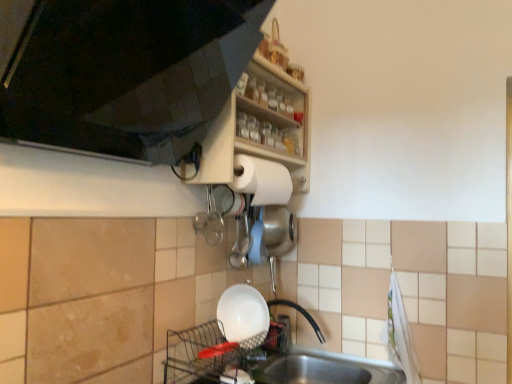
Question: From the image's perspective, is matte wood shelf at upper center positioned above or below white glossy bowl at lower center?

Choices:
 (A) below
 (B) above

Answer: (B)

Question: Is matte wood shelf at upper center inside the boundaries of white glossy bowl at lower center, or outside?

Choices:
 (A) inside
 (B) outside

Answer: (B)

Question: Estimate the real-world distances between objects in this image. Which object is closer to the stainless steel sink at lower center?

Choices:
 (A) wooden shelf at upper center
 (B) matte wood shelf at upper center
 (C) white glossy bowl at lower center
 (D) white matte paper towel at upper center

Answer: (C)

Question: Which is farther from the stainless steel sink at lower center?

Choices:
 (A) wooden shelf at upper center
 (B) white glossy bowl at lower center
 (C) matte wood shelf at upper center
 (D) white matte paper towel at upper center

Answer: (C)